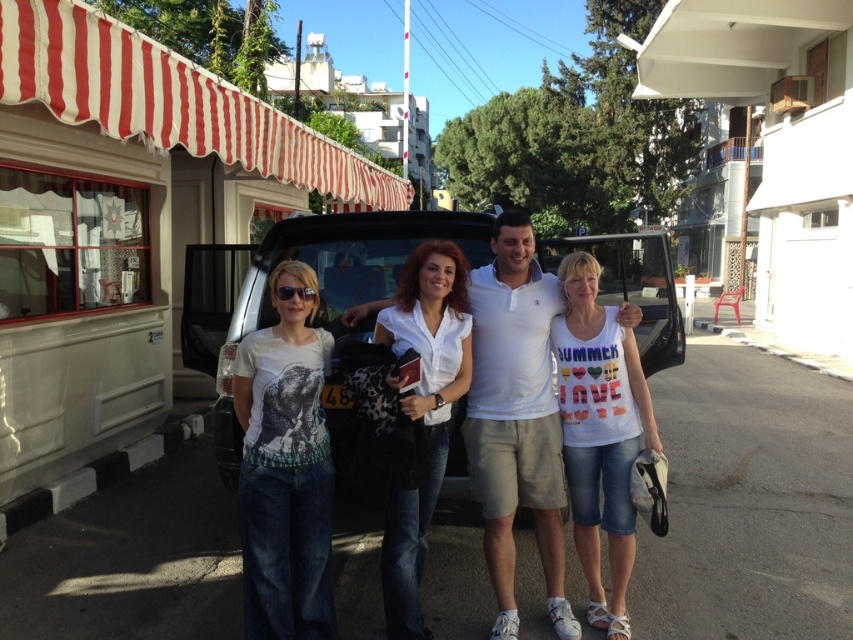
Question: Is white printed t-shirt at center to the right of matte black sunglasses at center from the viewer's perspective?

Choices:
 (A) no
 (B) yes

Answer: (A)

Question: Can you confirm if satin black car at center is positioned to the right of white printed t-shirt at center?

Choices:
 (A) no
 (B) yes

Answer: (A)

Question: Does satin black car at center appear on the left side of white cotton t-shirt at center?

Choices:
 (A) yes
 (B) no

Answer: (A)

Question: Based on their relative distances, which object is farther from the satin black car at center?

Choices:
 (A) matte black sunglasses at center
 (B) white cotton shirt at center
 (C) white cotton t-shirt at center
 (D) white printed t-shirt at center

Answer: (C)

Question: Which point is closer to the camera?

Choices:
 (A) white printed t-shirt at center
 (B) matte black sunglasses at center
 (C) white cotton shirt at center
 (D) satin black car at center

Answer: (A)

Question: Estimate the real-world distances between objects in this image. Which object is farther from the white cotton t-shirt at center?

Choices:
 (A) satin black car at center
 (B) white cotton shirt at center

Answer: (A)